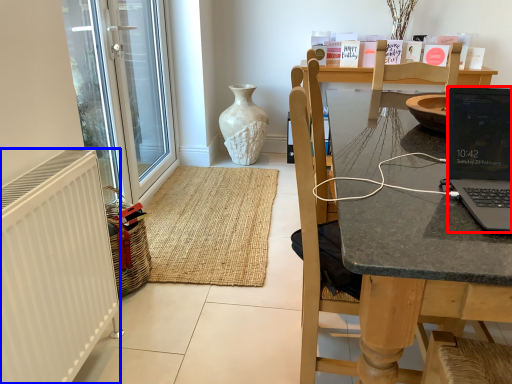
Question: Among these objects, which one is farthest to the camera, laptop (highlighted by a red box) or radiator (highlighted by a blue box)?

Choices:
 (A) laptop
 (B) radiator

Answer: (B)